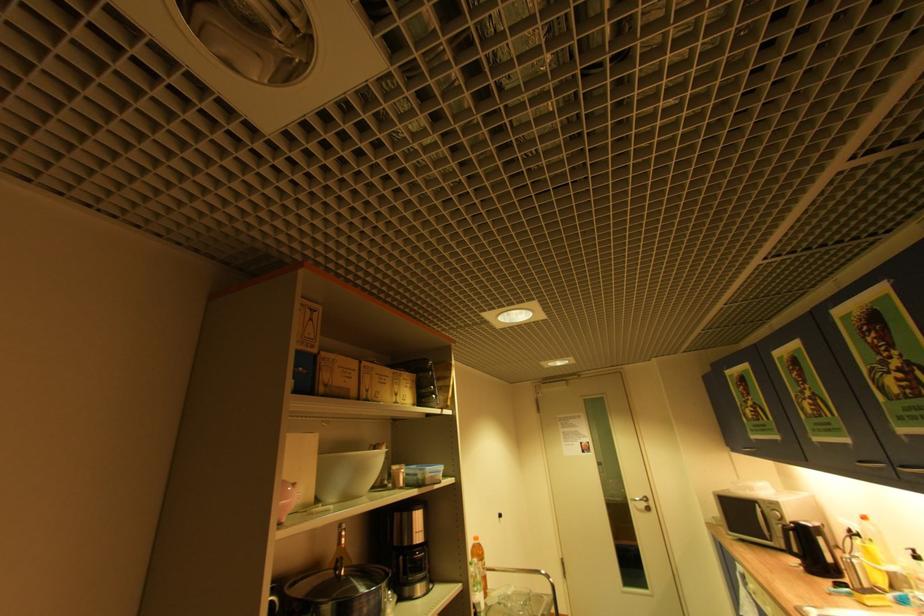
The width and height of the screenshot is (924, 616). In order to click on orange-capped bottle in this screenshot , I will do `click(478, 578)`.